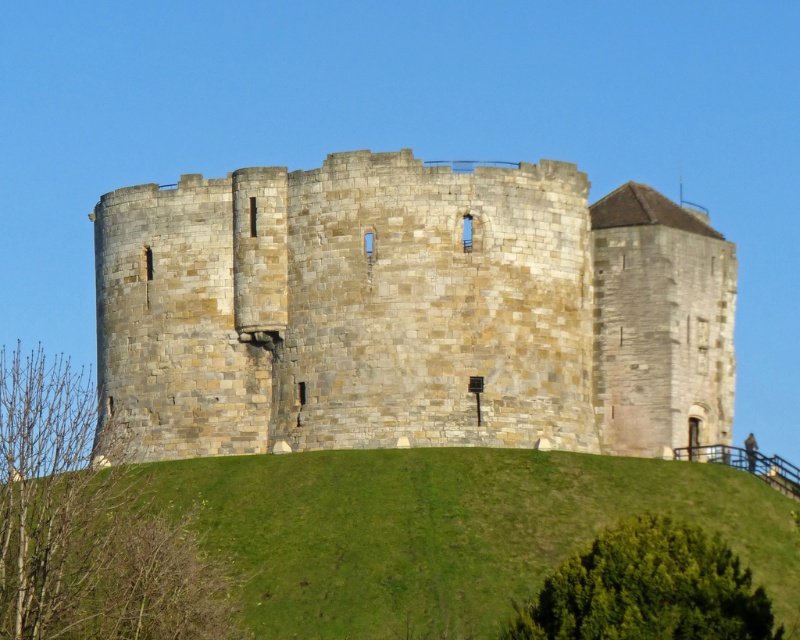
Question: Considering the relative positions of stone tower at center and green grassy hill at center in the image provided, where is stone tower at center located with respect to green grassy hill at center?

Choices:
 (A) right
 (B) left

Answer: (B)

Question: Among these objects, which one is farthest from the camera?

Choices:
 (A) stone tower at center
 (B) green grassy hill at center

Answer: (A)

Question: Does stone tower at center have a lesser width compared to green grassy hill at center?

Choices:
 (A) yes
 (B) no

Answer: (B)

Question: Which point is closer to the camera taking this photo?

Choices:
 (A) (458, 234)
 (B) (206, 481)

Answer: (B)

Question: Which of the following is the farthest from the observer?

Choices:
 (A) green grassy hill at center
 (B) stone tower at center

Answer: (B)

Question: Does stone tower at center have a greater width compared to green grassy hill at center?

Choices:
 (A) no
 (B) yes

Answer: (B)